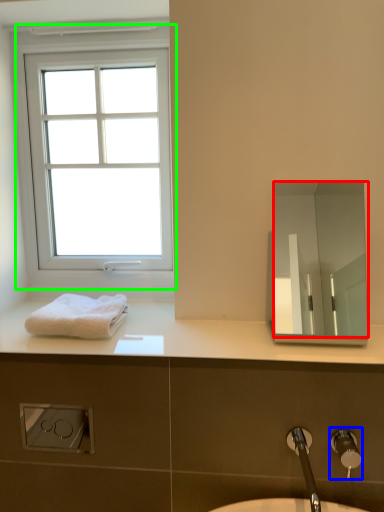
Question: Which object is positioned farthest from mirror (highlighted by a red box)? Select from plumbing fixture (highlighted by a blue box) and window (highlighted by a green box).

Choices:
 (A) plumbing fixture
 (B) window

Answer: (A)